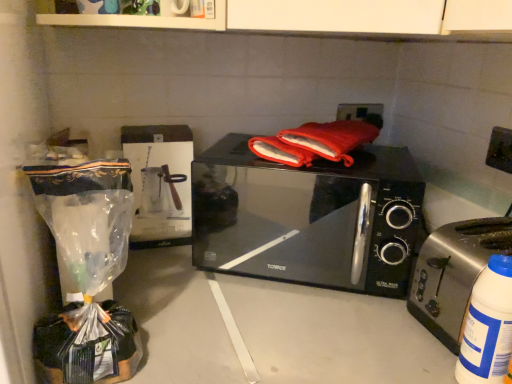
What do you see at coordinates (454, 273) in the screenshot? This screenshot has height=384, width=512. I see `satin silver toaster at right` at bounding box center [454, 273].

What is the approximate width of white plastic bottle at lower right?

It is 7.06 centimeters.

Measure the distance between point (212, 205) and camera.

The depth of point (212, 205) is 3.64 feet.

The image size is (512, 384). I want to click on black glossy microwave at center, so click(309, 218).

Locate an element on the screen. The height and width of the screenshot is (384, 512). satin silver toaster at right is located at coordinates (454, 273).

Could you tell me if black glossy microwave at center is facing satin silver toaster at right?

No, black glossy microwave at center is not turned towards satin silver toaster at right.

Looking at this image, is black glossy microwave at center far from satin silver toaster at right?

black glossy microwave at center is actually quite close to satin silver toaster at right.

In the scene shown: Is satin silver toaster at right a part of black glossy microwave at center?

No, satin silver toaster at right is not surrounded by black glossy microwave at center.

Is black glossy microwave at center closer to camera compared to satin silver toaster at right?

No, the depth of black glossy microwave at center is greater than that of satin silver toaster at right.

Find the location of a particular element. Image resolution: width=512 pixels, height=384 pixels. bottle below the satin silver toaster at right (from the image's perspective) is located at coordinates (488, 326).

Is satin silver toaster at right turned away from white plastic bottle at lower right?

No, satin silver toaster at right is not facing away from white plastic bottle at lower right.

Is point (498, 232) less distant than point (490, 270)?

No, (498, 232) is behind (490, 270).

Based on the photo, from a real-world perspective, who is located higher, satin silver toaster at right or white plastic bottle at lower right?

satin silver toaster at right, from a real-world perspective.

Between white plastic bottle at lower right and black glossy microwave at center, which one has more height?

black glossy microwave at center is taller.

Are white plastic bottle at lower right and black glossy microwave at center located far from each other?

No.

Considering the positions of points (478, 376) and (200, 209), is point (478, 376) closer to camera compared to point (200, 209)?

Yes, it is in front of point (200, 209).

I want to click on bottle in front of the black glossy microwave at center, so click(488, 326).

Which is closer, (267,246) or (484,300)?

The point (484,300) is closer.

In terms of size, does black glossy microwave at center appear bigger or smaller than white plastic bottle at lower right?

In the image, black glossy microwave at center appears to be larger than white plastic bottle at lower right.

How different are the orientations of black glossy microwave at center and white plastic bottle at lower right in degrees?

They differ by 59.6 degrees in their facing directions.

From the image's perspective, which one is positioned lower, black glossy microwave at center or white plastic bottle at lower right?

white plastic bottle at lower right appears lower in the image.

Does satin silver toaster at right appear on the left side of black glossy microwave at center?

No.

Would you say black glossy microwave at center is part of satin silver toaster at right's contents?

That's incorrect, black glossy microwave at center is not inside satin silver toaster at right.

Can you tell me how much satin silver toaster at right and black glossy microwave at center differ in facing direction?

The angle between the facing direction of satin silver toaster at right and the facing direction of black glossy microwave at center is 57.7 degrees.

Is satin silver toaster at right surrounded by white plastic bottle at lower right?

Definitely not — satin silver toaster at right is not inside white plastic bottle at lower right.

Considering the sizes of objects white plastic bottle at lower right and satin silver toaster at right in the image provided, who is taller, white plastic bottle at lower right or satin silver toaster at right?

satin silver toaster at right is taller.

Considering the positions of objects white plastic bottle at lower right and satin silver toaster at right in the image provided, who is behind, white plastic bottle at lower right or satin silver toaster at right?

satin silver toaster at right.

From the image's perspective, which is below, white plastic bottle at lower right or satin silver toaster at right?

white plastic bottle at lower right, from the image's perspective.

Identify the location of toaster that is above the black glossy microwave at center (from a real-world perspective). The height and width of the screenshot is (384, 512). (454, 273).

The height and width of the screenshot is (384, 512). I want to click on bottle lying below the satin silver toaster at right (from the image's perspective), so click(488, 326).

Which object lies nearer to the anchor point white plastic bottle at lower right, black glossy microwave at center or satin silver toaster at right?

satin silver toaster at right is closer to white plastic bottle at lower right.

Considering their positions, is satin silver toaster at right positioned further to white plastic bottle at lower right than black glossy microwave at center?

Based on the image, black glossy microwave at center appears to be further to white plastic bottle at lower right.

When comparing their distances from satin silver toaster at right, does black glossy microwave at center or white plastic bottle at lower right seem further?

black glossy microwave at center lies further to satin silver toaster at right than the other object.

Which object lies nearer to the anchor point satin silver toaster at right, white plastic bottle at lower right or black glossy microwave at center?

white plastic bottle at lower right.

Estimate the real-world distances between objects in this image. Which object is closer to black glossy microwave at center, satin silver toaster at right or white plastic bottle at lower right?

satin silver toaster at right lies closer to black glossy microwave at center than the other object.

From the image, which object appears to be farther from black glossy microwave at center, white plastic bottle at lower right or satin silver toaster at right?

Among the two, white plastic bottle at lower right is located further to black glossy microwave at center.

The image size is (512, 384). In order to click on bottle between black glossy microwave at center and satin silver toaster at right in this screenshot , I will do `click(488, 326)`.